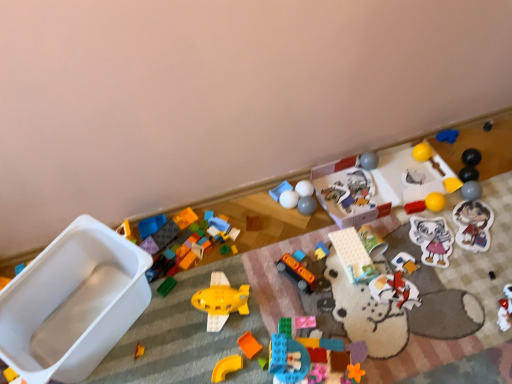
The width and height of the screenshot is (512, 384). I want to click on vacant space situated on the left part of matte gray ball at right, which appears as the 24th toy when viewed from the left, so click(x=431, y=211).